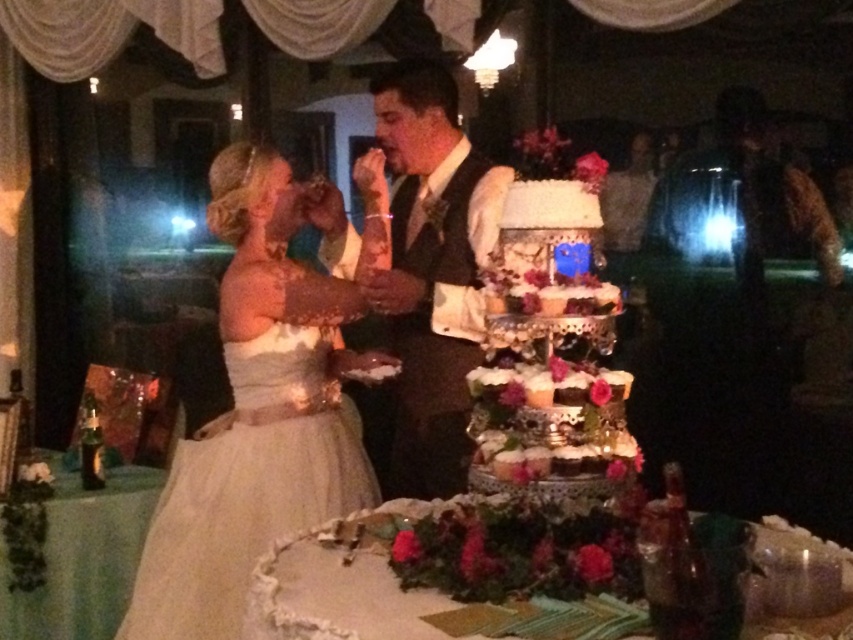
Question: Is ivory satin dress at left above matte black vest at center?

Choices:
 (A) no
 (B) yes

Answer: (A)

Question: Can you confirm if ivory satin dress at left is positioned below matte black vest at center?

Choices:
 (A) no
 (B) yes

Answer: (B)

Question: Which object is farther from the camera taking this photo?

Choices:
 (A) matte black vest at center
 (B) ivory satin dress at left

Answer: (A)

Question: Which point is farther to the camera?

Choices:
 (A) ivory satin dress at left
 (B) matte black vest at center

Answer: (B)

Question: Can you confirm if ivory satin dress at left is positioned to the left of matte black vest at center?

Choices:
 (A) no
 (B) yes

Answer: (B)

Question: Which object appears farthest from the camera in this image?

Choices:
 (A) ivory satin dress at left
 (B) matte black vest at center

Answer: (B)